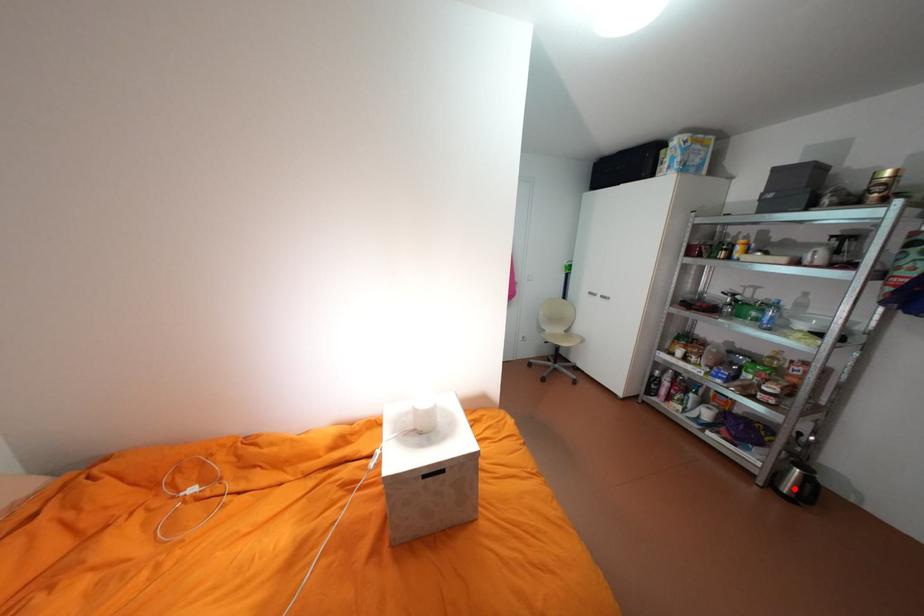
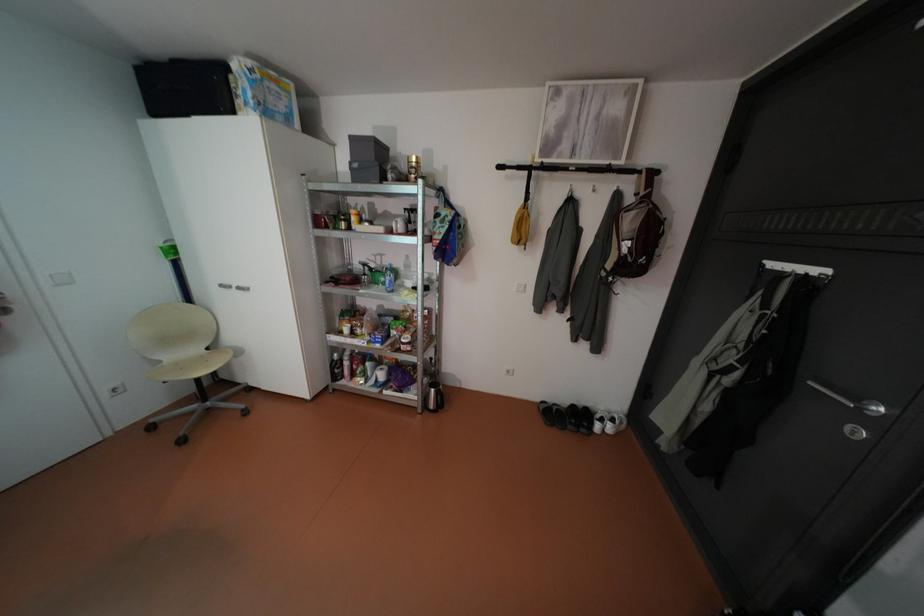
Question: A red point is marked in image1. In image2, is the corresponding 3D point closer to the camera or farther? Reply with the corresponding letter.

Choices:
 (A) The corresponding 3D point is closer.
 (B) The corresponding 3D point is farther.

Answer: (B)